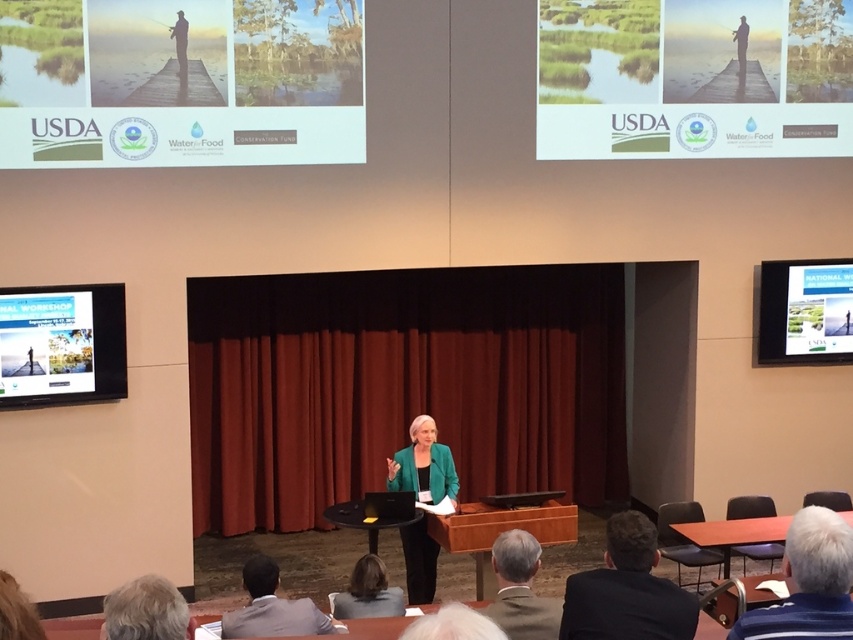
Question: Is gray wool suit at lower center to the right of smooth brown hair at lower center from the viewer's perspective?

Choices:
 (A) no
 (B) yes

Answer: (B)

Question: Estimate the real-world distances between objects in this image. Which object is closer to the smooth brown hair at lower center?

Choices:
 (A) dark suit at lower right
 (B) black velvet curtain at center

Answer: (A)

Question: Which of the following is the farthest from the observer?

Choices:
 (A) matte black fishing pole at upper right
 (B) smooth brown hair at lower center
 (C) black velvet curtain at center

Answer: (C)

Question: Can you confirm if matte black dock at upper left is positioned to the left of green fabric jacket at center?

Choices:
 (A) no
 (B) yes

Answer: (B)

Question: Does green fabric jacket at center appear on the right side of gray wool suit at lower center?

Choices:
 (A) yes
 (B) no

Answer: (B)

Question: Estimate the real-world distances between objects in this image. Which object is closer to the dark brown leather jacket at lower left?

Choices:
 (A) smooth brown hair at lower center
 (B) matte black screen at lower left
 (C) gray hair at lower left

Answer: (A)